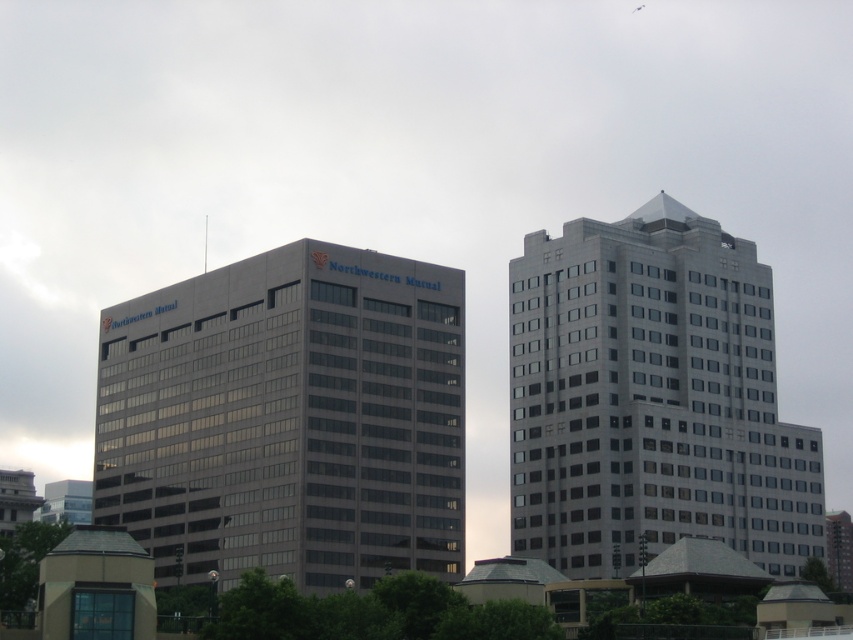
Question: Is gray glass building at center to the right of sleek silver building at right from the viewer's perspective?

Choices:
 (A) yes
 (B) no

Answer: (B)

Question: Does gray glass building at center lie behind sleek silver building at right?

Choices:
 (A) no
 (B) yes

Answer: (A)

Question: Can you confirm if gray glass building at center is positioned above sleek silver building at right?

Choices:
 (A) no
 (B) yes

Answer: (A)

Question: Which point is closer to the camera?

Choices:
 (A) (630, 426)
 (B) (311, 449)

Answer: (B)

Question: Which of the following is the closest to the observer?

Choices:
 (A) (274, 548)
 (B) (578, 577)

Answer: (A)